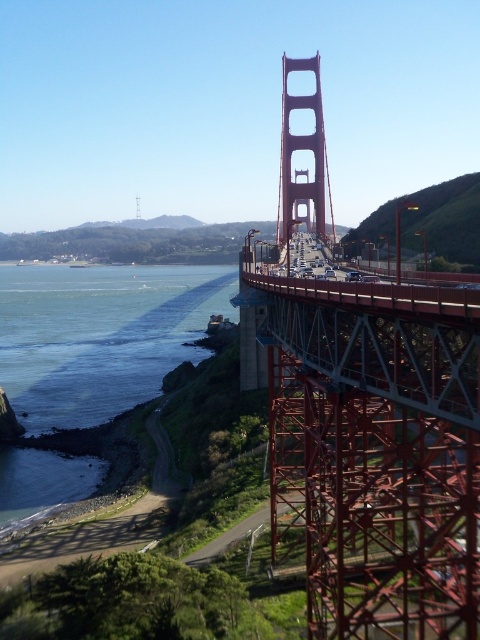
Question: Does red painted steel suspension bridge at center have a lesser width compared to blue water at lower left?

Choices:
 (A) yes
 (B) no

Answer: (A)

Question: Which of the following is the closest to the observer?

Choices:
 (A) (351, 291)
 (B) (66, 336)

Answer: (A)

Question: Which point is closer to the camera?

Choices:
 (A) (183, 273)
 (B) (446, 440)

Answer: (B)

Question: Is red painted steel suspension bridge at center thinner than blue water at lower left?

Choices:
 (A) no
 (B) yes

Answer: (B)

Question: Observing the image, what is the correct spatial positioning of red painted steel suspension bridge at center in reference to blue water at lower left?

Choices:
 (A) right
 (B) left

Answer: (A)